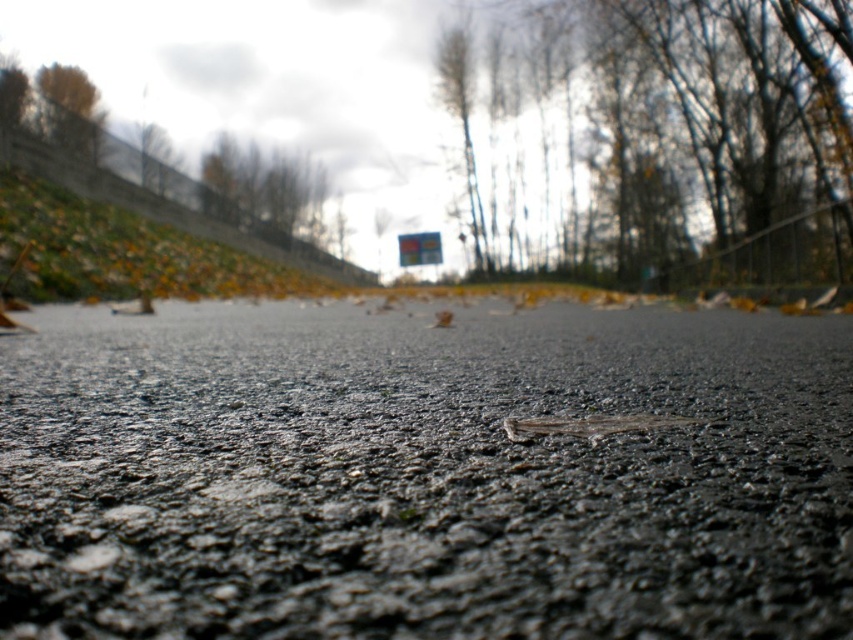
Question: Is bare branches at upper center positioned before brown leafy tree at upper center?

Choices:
 (A) yes
 (B) no

Answer: (A)

Question: Estimate the real-world distances between objects in this image. Which object is closer to the brown leafy tree at upper center?

Choices:
 (A) bare branches at upper center
 (B) black asphalt gravel at center

Answer: (A)

Question: Which of these objects is positioned farthest from the bare branches at upper center?

Choices:
 (A) black asphalt gravel at center
 (B) brown leafy tree at upper center

Answer: (A)

Question: Can you confirm if black asphalt gravel at center is bigger than brown leafy tree at upper center?

Choices:
 (A) no
 (B) yes

Answer: (A)

Question: Considering the relative positions of bare branches at upper center and brown leafy tree at upper center in the image provided, where is bare branches at upper center located with respect to brown leafy tree at upper center?

Choices:
 (A) above
 (B) below

Answer: (B)

Question: Among these points, which one is farthest from the camera?

Choices:
 (A) (312, 220)
 (B) (753, 161)

Answer: (A)